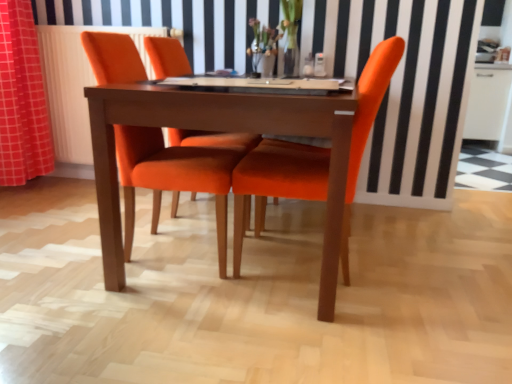
Identify the location of orange fabric chair at center, the first chair when ordered from right to left. (277, 181).

Measure the distance between point [274,165] and camera.

Point [274,165] is 1.70 meters from camera.

Locate an element on the screen. orange fabric chair at center, positioned as the 1th chair in left-to-right order is located at coordinates (173, 164).

Locate an element on the screen. The height and width of the screenshot is (384, 512). white radiator at left is located at coordinates (76, 90).

Describe the element at coordinates (76, 90) in the screenshot. I see `white radiator at left` at that location.

You are a GUI agent. You are given a task and a screenshot of the screen. Output one action in this format:
    pyautogui.click(x=<x>, y=<y>)
    Task: Click on the orange fabric chair at center, the first chair when ordered from right to left
    This screenshot has width=512, height=384.
    Given the screenshot: What is the action you would take?
    pyautogui.click(x=277, y=181)

Between wooden table at center and orange fabric curtain at left, which one has more height?

Standing taller between the two is orange fabric curtain at left.

Can you tell me how much wooden table at center and orange fabric curtain at left differ in facing direction?

The facing directions of wooden table at center and orange fabric curtain at left are 91.6 degrees apart.

Would you say wooden table at center is outside orange fabric curtain at left?

Yes, wooden table at center is outside of orange fabric curtain at left.

Is wooden table at center positioned before orange fabric curtain at left?

Yes, the depth of wooden table at center is less than that of orange fabric curtain at left.

From the image's perspective, between wooden table at center and orange fabric chair at center, which appears as the second chair when viewed from the left, who is located below?

orange fabric chair at center, which appears as the second chair when viewed from the left, is shown below in the image.

Locate an element on the screen. Image resolution: width=512 pixels, height=384 pixels. kitchen & dining room table on the left of orange fabric chair at center, the first chair when ordered from right to left is located at coordinates (277, 147).

How many degrees apart are the facing directions of wooden table at center and orange fabric chair at center, which appears as the second chair when viewed from the left?

89.6 degrees.

From a real-world perspective, is orange fabric curtain at left located beneath wooden table at center?

Actually, orange fabric curtain at left is physically above wooden table at center in the real world.

Does orange fabric curtain at left have a greater width compared to wooden table at center?

In fact, orange fabric curtain at left might be narrower than wooden table at center.

What's the angular difference between orange fabric curtain at left and wooden table at center's facing directions?

The angular difference between orange fabric curtain at left and wooden table at center is 91.6 degrees.

Image resolution: width=512 pixels, height=384 pixels. Identify the location of curtain in front of the white radiator at left. (22, 99).

How much distance is there between orange fabric curtain at left and white radiator at left?

A distance of 10.60 inches exists between orange fabric curtain at left and white radiator at left.

Based on their positions, is orange fabric curtain at left located to the left or right of white radiator at left?

orange fabric curtain at left is positioned on white radiator at left's left side.

Is orange fabric curtain at left turned away from white radiator at left?

orange fabric curtain at left does not have its back to white radiator at left.

Based on the photo, from a real-world perspective, who is located higher, white radiator at left or wooden table at center?

white radiator at left, from a real-world perspective.

Considering their positions, is white radiator at left located in front of or behind wooden table at center?

In the image, white radiator at left appears behind wooden table at center.

Is white radiator at left oriented away from wooden table at center?

white radiator at left does not have its back to wooden table at center.

Can you tell me how much orange fabric curtain at left and orange fabric chair at center, positioned as the 1th chair in left-to-right order, differ in facing direction?

There is a 1.19-degree angle between the facing directions of orange fabric curtain at left and orange fabric chair at center, positioned as the 1th chair in left-to-right order.

Is orange fabric curtain at left inside or outside of orange fabric chair at center, positioned as the 1th chair in left-to-right order?

orange fabric curtain at left is located beyond the bounds of orange fabric chair at center, positioned as the 1th chair in left-to-right order.

Considering the relative positions of orange fabric curtain at left and orange fabric chair at center, positioned as the 1th chair in left-to-right order, in the image provided, is orange fabric curtain at left to the right of orange fabric chair at center, positioned as the 1th chair in left-to-right order, from the viewer's perspective?

No.

Is orange fabric curtain at left positioned with its back to orange fabric chair at center, positioned as the 1th chair in left-to-right order?

No, orange fabric curtain at left is not facing away from orange fabric chair at center, positioned as the 1th chair in left-to-right order.

Considering the relative sizes of orange fabric chair at center, the 2th chair when ordered from right to left, and orange fabric curtain at left in the image provided, is orange fabric chair at center, the 2th chair when ordered from right to left, thinner than orange fabric curtain at left?

No.

Is orange fabric chair at center, the 2th chair when ordered from right to left, in front of or behind orange fabric curtain at left in the image?

In the image, orange fabric chair at center, the 2th chair when ordered from right to left, appears in front of orange fabric curtain at left.

From the image's perspective, would you say orange fabric chair at center, the 2th chair when ordered from right to left, is shown under orange fabric curtain at left?

Yes, from the image's perspective, orange fabric chair at center, the 2th chair when ordered from right to left, is beneath orange fabric curtain at left.

Between orange fabric chair at center, positioned as the 1th chair in left-to-right order, and orange fabric curtain at left, which one has larger size?

orange fabric chair at center, positioned as the 1th chair in left-to-right order, is bigger.

In the image, there is a orange fabric curtain at left. Identify the location of kitchen & dining room table below it (from the image's perspective). (277, 147).

Identify the location of the 1st chair behind the wooden table at center. The width and height of the screenshot is (512, 384). (277, 181).

Based on their spatial positions, is orange fabric chair at center, the 2th chair when ordered from right to left, or wooden table at center further from white radiator at left?

Among the two, wooden table at center is located further to white radiator at left.

When comparing their distances from orange fabric chair at center, the first chair when ordered from right to left, does orange fabric chair at center, positioned as the 1th chair in left-to-right order, or white radiator at left seem closer?

orange fabric chair at center, positioned as the 1th chair in left-to-right order.

Based on the photo, considering their positions, is wooden table at center positioned further to orange fabric chair at center, the first chair when ordered from right to left, than orange fabric curtain at left?

orange fabric curtain at left lies further to orange fabric chair at center, the first chair when ordered from right to left, than the other object.

Considering their positions, is white radiator at left positioned further to orange fabric curtain at left than orange fabric chair at center, the first chair when ordered from right to left?

The object further to orange fabric curtain at left is orange fabric chair at center, the first chair when ordered from right to left.

From the image, which object appears to be nearer to orange fabric chair at center, positioned as the 1th chair in left-to-right order, orange fabric chair at center, which appears as the second chair when viewed from the left, or wooden table at center?

wooden table at center is positioned closer to the anchor orange fabric chair at center, positioned as the 1th chair in left-to-right order.

Which object lies nearer to the anchor point orange fabric curtain at left, wooden table at center or orange fabric chair at center, positioned as the 1th chair in left-to-right order?

orange fabric chair at center, positioned as the 1th chair in left-to-right order, is positioned closer to the anchor orange fabric curtain at left.

From the image, which object appears to be nearer to white radiator at left, orange fabric chair at center, which appears as the second chair when viewed from the left, or orange fabric curtain at left?

orange fabric curtain at left lies closer to white radiator at left than the other object.

Looking at the image, which one is located further to wooden table at center, white radiator at left or orange fabric curtain at left?

orange fabric curtain at left.

Where is `chair between orange fabric chair at center, the first chair when ordered from right to left, and white radiator at left from front to back`? chair between orange fabric chair at center, the first chair when ordered from right to left, and white radiator at left from front to back is located at coordinates (173, 164).

At what (x,y) coordinates should I click in order to perform the action: click on chair between orange fabric curtain at left and wooden table at center. Please return your answer as a coordinate pair (x, y). Looking at the image, I should click on (173, 164).

Image resolution: width=512 pixels, height=384 pixels. In order to click on radiator located between orange fabric curtain at left and orange fabric chair at center, the first chair when ordered from right to left, in the left-right direction in this screenshot , I will do `click(76, 90)`.

Find the location of a particular element. The height and width of the screenshot is (384, 512). curtain located between orange fabric chair at center, positioned as the 1th chair in left-to-right order, and white radiator at left in the depth direction is located at coordinates (22, 99).